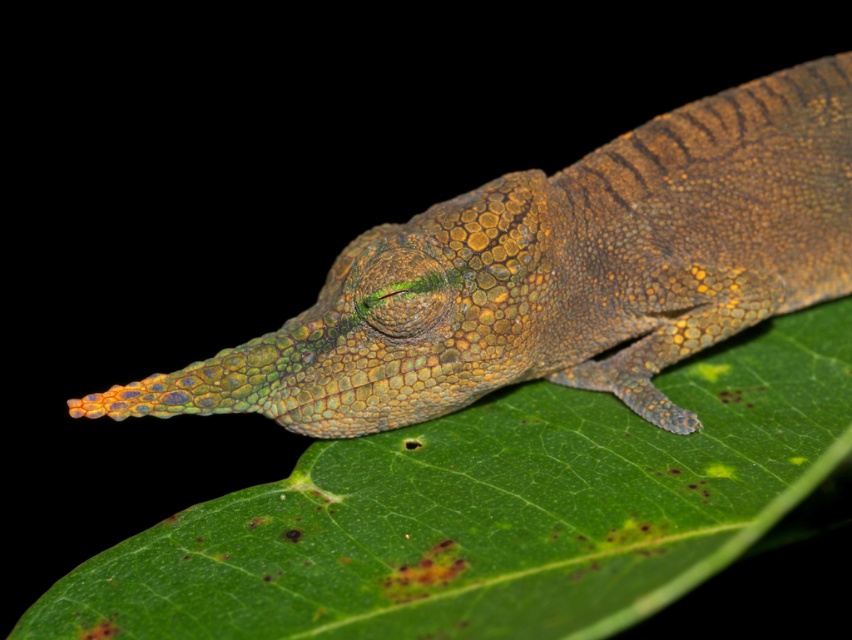
Is green matte leaf at center further to the viewer compared to green scaly lizard at center?

No, it is not.

Where is `green matte leaf at center`? Image resolution: width=852 pixels, height=640 pixels. green matte leaf at center is located at coordinates (492, 512).